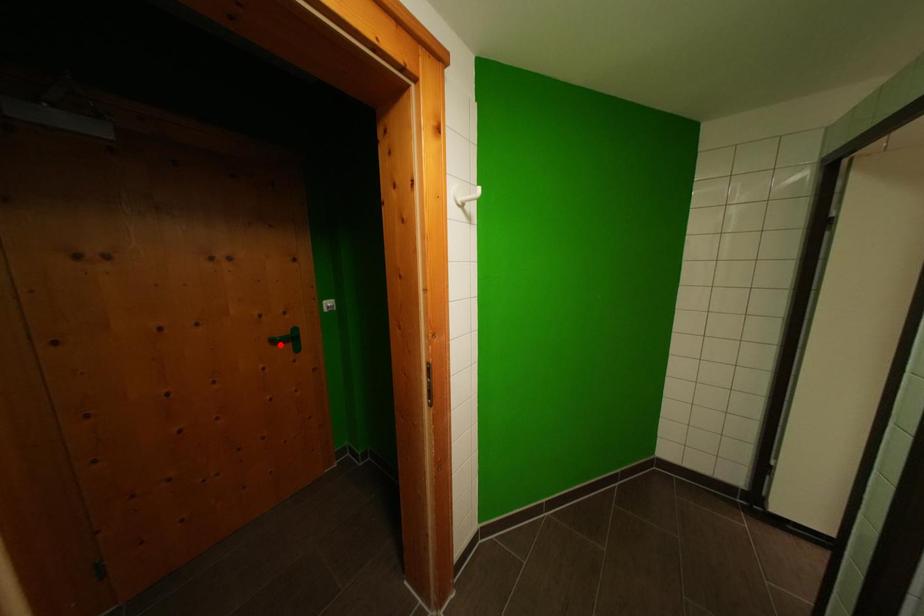
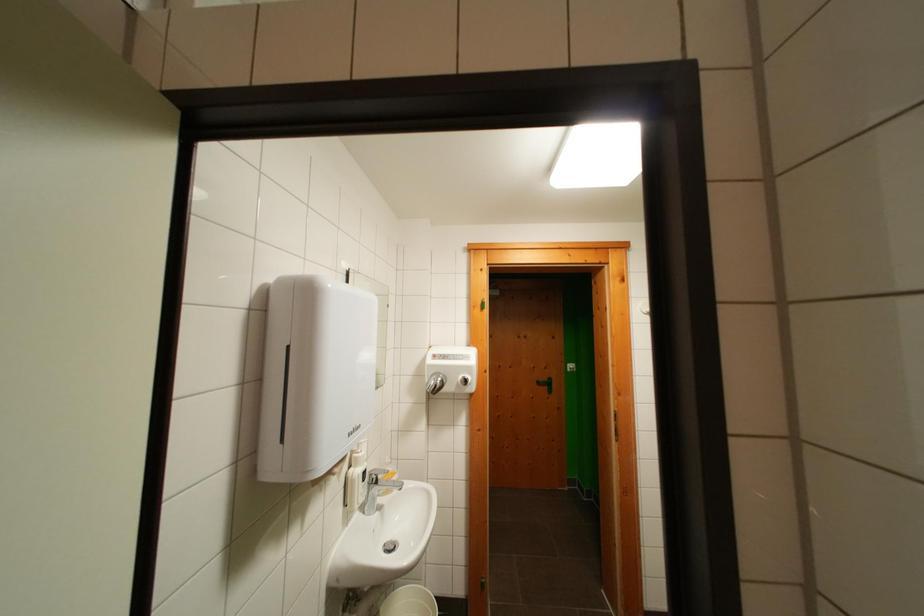
In the second image, find the point that corresponds to the highlighted location in the first image.

(544, 387)